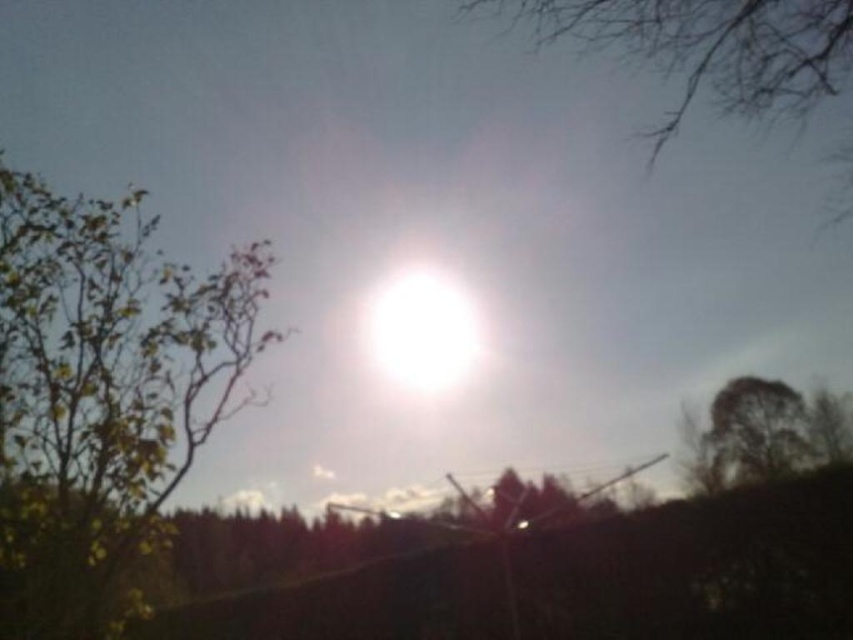
Who is more distant from viewer, (3,634) or (422,324)?

Positioned behind is point (422,324).

Is green leafy tree at left positioned behind white glossy sun at center?

No, it is in front of white glossy sun at center.

What are the coordinates of `green leafy tree at left` in the screenshot? It's located at (102, 394).

Does green leafy tree at left have a larger size compared to dark green textured tree at lower right?

No, green leafy tree at left is not bigger than dark green textured tree at lower right.

Based on the photo, is green leafy tree at left below dark green textured tree at lower right?

No, green leafy tree at left is not below dark green textured tree at lower right.

Between point (32, 333) and point (734, 429), which one is positioned behind?

Point (734, 429)

This screenshot has height=640, width=853. What are the coordinates of `green leafy tree at left` in the screenshot? It's located at (102, 394).

Is bare branches at upper right taller than dark green textured tree at lower right?

Incorrect, bare branches at upper right's height is not larger of dark green textured tree at lower right's.

Who is taller, bare branches at upper right or dark green textured tree at lower right?

dark green textured tree at lower right

Between point (698, 77) and point (737, 394), which one is positioned behind?

Positioned behind is point (737, 394).

Locate an element on the screen. bare branches at upper right is located at coordinates (715, 48).